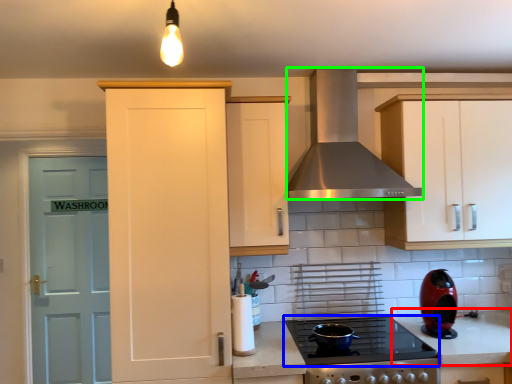
Question: Which is farther away from counter top (highlighted by a red box)? gas stove (highlighted by a blue box) or home appliance (highlighted by a green box)?

Choices:
 (A) gas stove
 (B) home appliance

Answer: (B)